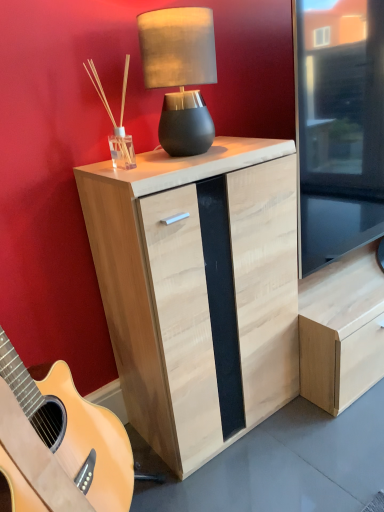
Locate an element on the screen. free space to the left of matte black lamp at upper center is located at coordinates click(x=134, y=157).